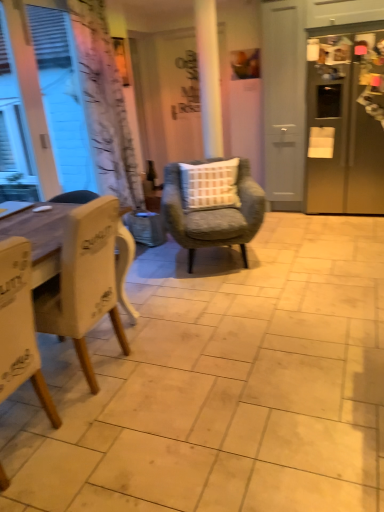
Question: Can you confirm if satin silver refrigerator at right is shorter than white wood chair at left, the first chair from the front?

Choices:
 (A) no
 (B) yes

Answer: (A)

Question: Is white wood chair at left, the first chair from the front, completely or partially inside satin silver refrigerator at right?

Choices:
 (A) no
 (B) yes

Answer: (A)

Question: Does satin silver refrigerator at right have a lesser width compared to white wood chair at left, which is counted as the third chair, starting from the back?

Choices:
 (A) yes
 (B) no

Answer: (B)

Question: Considering the relative sizes of satin silver refrigerator at right and white wood chair at left, which is counted as the third chair, starting from the back, in the image provided, is satin silver refrigerator at right taller than white wood chair at left, which is counted as the third chair, starting from the back,?

Choices:
 (A) no
 (B) yes

Answer: (B)

Question: Is satin silver refrigerator at right behind white wood chair at left, which is counted as the third chair, starting from the back?

Choices:
 (A) no
 (B) yes

Answer: (B)

Question: Is satin silver refrigerator at right facing away from white wood chair at left, which is counted as the third chair, starting from the back?

Choices:
 (A) no
 (B) yes

Answer: (A)

Question: Is textured gray armchair at center, which appears as the first chair when viewed from the back, facing away from clear glass bottle at center?

Choices:
 (A) yes
 (B) no

Answer: (A)

Question: Can you confirm if textured gray armchair at center, which appears as the first chair when viewed from the back, is taller than clear glass bottle at center?

Choices:
 (A) no
 (B) yes

Answer: (B)

Question: From the image's perspective, is textured gray armchair at center, which appears as the first chair when viewed from the back, above clear glass bottle at center?

Choices:
 (A) yes
 (B) no

Answer: (B)

Question: Is textured gray armchair at center, which appears as the first chair when viewed from the back, further to the viewer compared to clear glass bottle at center?

Choices:
 (A) yes
 (B) no

Answer: (B)

Question: Is the position of textured gray armchair at center, the third chair positioned from the front, less distant than that of clear glass bottle at center?

Choices:
 (A) no
 (B) yes

Answer: (B)

Question: Is textured gray armchair at center, the third chair positioned from the front, located outside clear glass bottle at center?

Choices:
 (A) yes
 (B) no

Answer: (A)

Question: Can you confirm if white matte window at left is thinner than white wood chair at left, which is counted as the third chair, starting from the back?

Choices:
 (A) no
 (B) yes

Answer: (B)